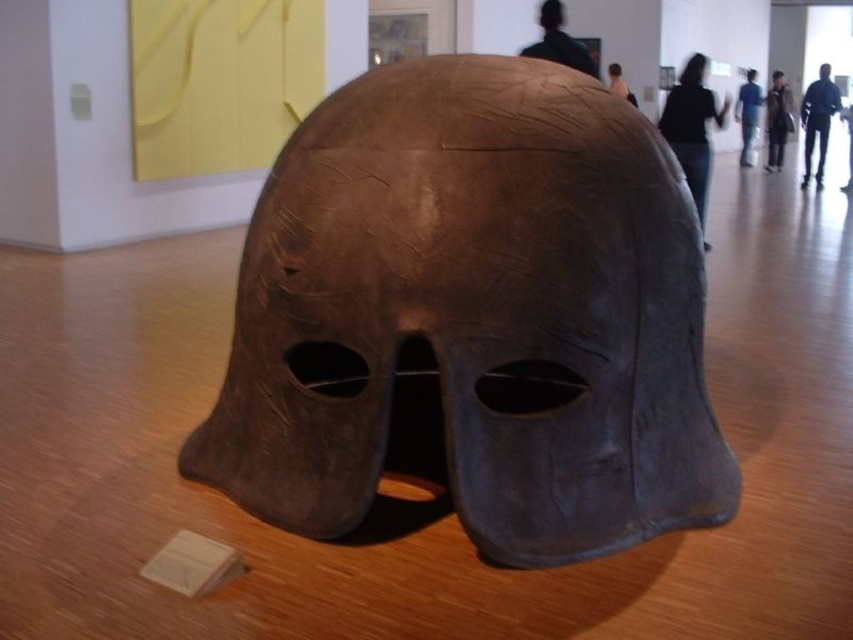
Question: Does blue jeans at center appear under matte brown mask at center?

Choices:
 (A) yes
 (B) no

Answer: (B)

Question: Is brown matte helmet at center below brown leather jacket at upper right?

Choices:
 (A) yes
 (B) no

Answer: (A)

Question: Which is nearer to the matte brown mask at center?

Choices:
 (A) black matte jacket at upper center
 (B) blue jeans at center
 (C) black leather mask at upper center

Answer: (A)

Question: Which point is closer to the camera taking this photo?

Choices:
 (A) (610, 76)
 (B) (502, 209)
 (C) (747, 68)

Answer: (B)

Question: Which object appears farthest from the camera in this image?

Choices:
 (A) black matte jacket at upper center
 (B) black leather mask at upper center
 (C) brown matte helmet at center

Answer: (A)

Question: Is black leather jacket at upper right further to camera compared to blue jeans at center?

Choices:
 (A) yes
 (B) no

Answer: (B)